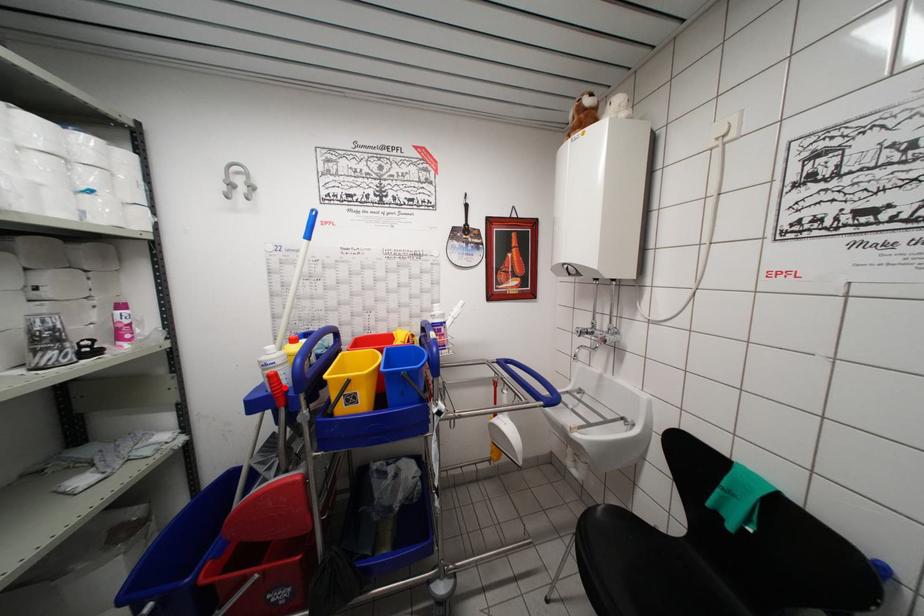
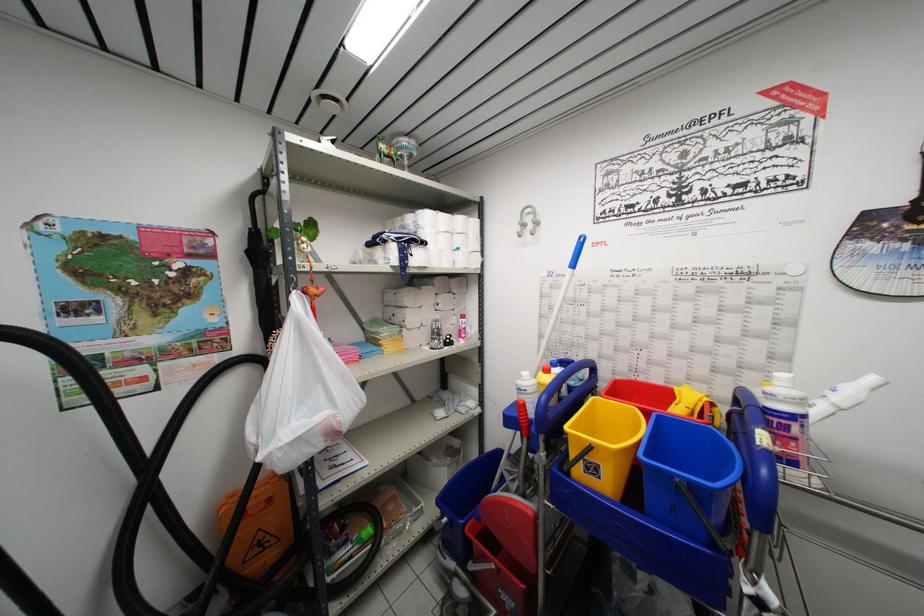
Locate, in the second image, the point that corresponds to the highlighted location in the first image.

(530, 419)